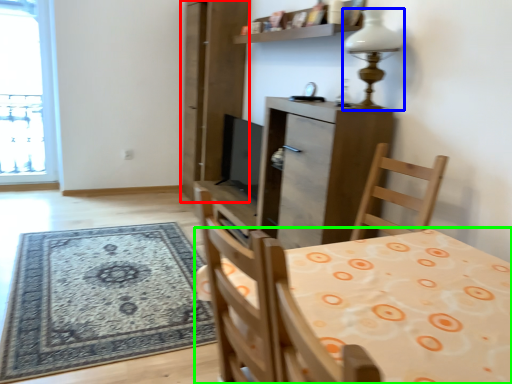
Question: Estimate the real-world distances between objects in this image. Which object is farther from screen door (highlighted by a red box), lamp (highlighted by a blue box) or table (highlighted by a green box)?

Choices:
 (A) lamp
 (B) table

Answer: (B)